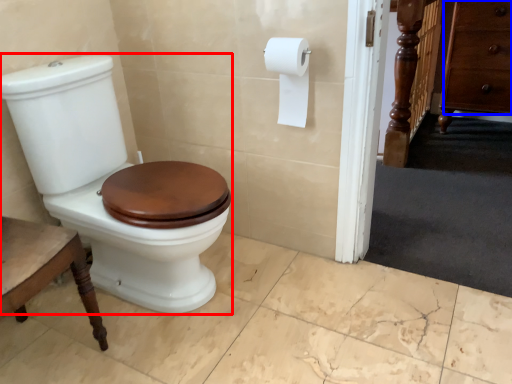
Question: Which of the following is the closest to the observer, porcelain (highlighted by a red box) or drawer (highlighted by a blue box)?

Choices:
 (A) porcelain
 (B) drawer

Answer: (A)